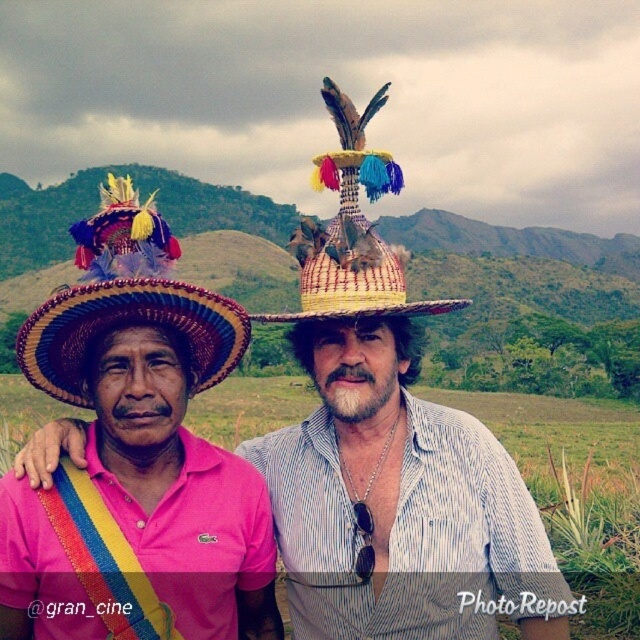
You are a photographer trying to capture a detailed shot of the woven straw hat at left. Given that your camera has a focal length of 50mm and you are positioned 3 meters away from the hat, can you estimate the approximate height of the hat in centimeters using the coordinates provided in the scene description?

The position of woven straw hat at left is at point (125, 300). Using the formula for calculating object height based on focal length and distance, the height would be approximately 14.3 cm.

You are a photographer trying to capture a photo of the two hats in the scene. You want to ensure that the woven straw hat at left and the bright yellow woven hat at center are both visible in your frame. Based on their positions, which hat should you focus on first to include both in the shot?

Since the woven straw hat at left is to the left of the bright yellow woven hat at center, you should focus on the bright yellow woven hat at center first to ensure both hats are included in the frame.